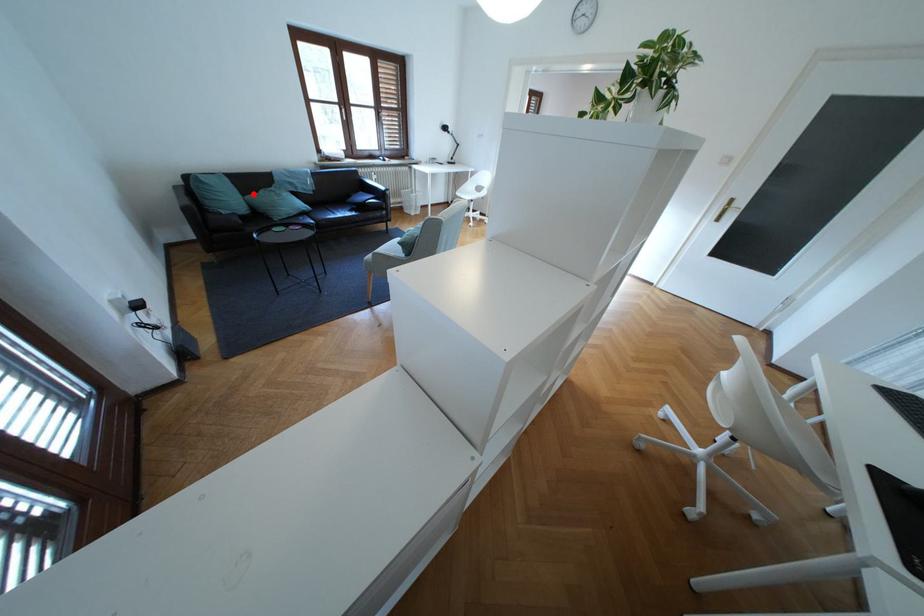
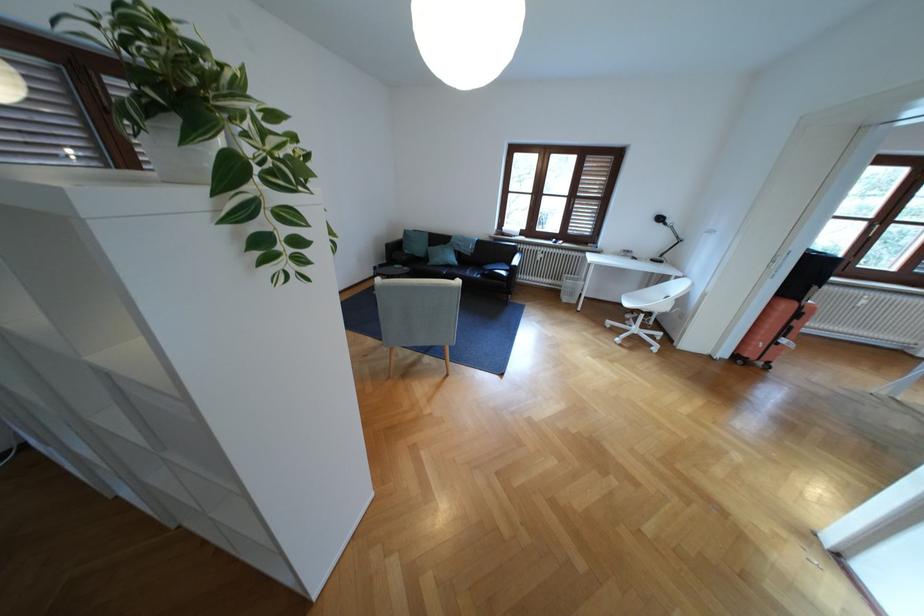
Locate, in the second image, the point that corresponds to the highlighted location in the first image.

(440, 246)